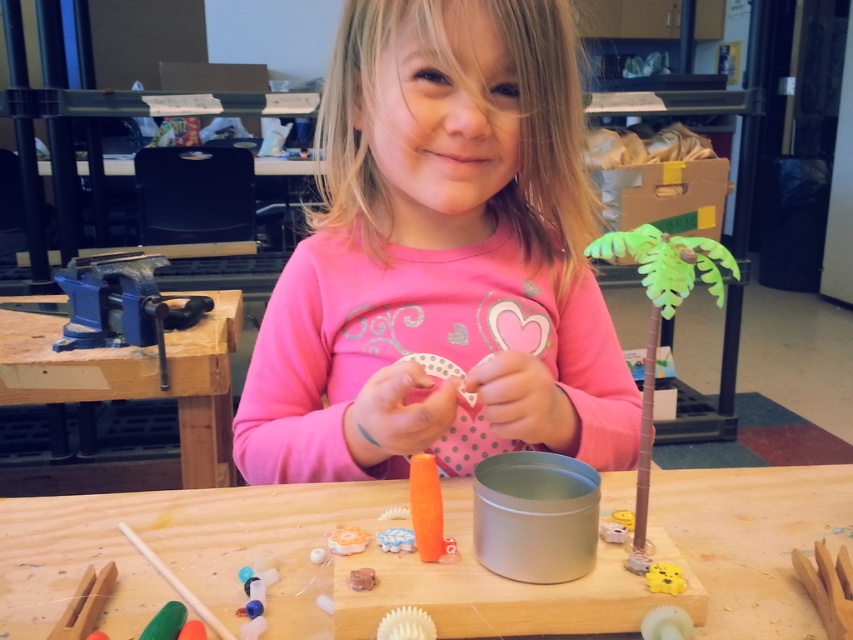
Can you confirm if blue wood table at left is bigger than green matte plant at right?

Indeed, blue wood table at left has a larger size compared to green matte plant at right.

This screenshot has height=640, width=853. In order to click on blue wood table at left in this screenshot , I will do `click(136, 378)`.

Between green matte plant at right and matte orange glue stick at center, which one is positioned lower?

matte orange glue stick at center is lower down.

Who is more forward, (648,227) or (410,532)?

Positioned in front is point (648,227).

This screenshot has height=640, width=853. What are the coordinates of `green matte plant at right` in the screenshot? It's located at (659, 324).

Between blue metal vise at left and matte orange glue stick at center, which one appears on the left side from the viewer's perspective?

From the viewer's perspective, blue metal vise at left appears more on the left side.

Does blue metal vise at left appear on the left side of matte orange glue stick at center?

Indeed, blue metal vise at left is positioned on the left side of matte orange glue stick at center.

Is point (202, 314) in front of point (403, 529)?

No, it is not.

This screenshot has width=853, height=640. What are the coordinates of `blue metal vise at left` in the screenshot? It's located at (122, 305).